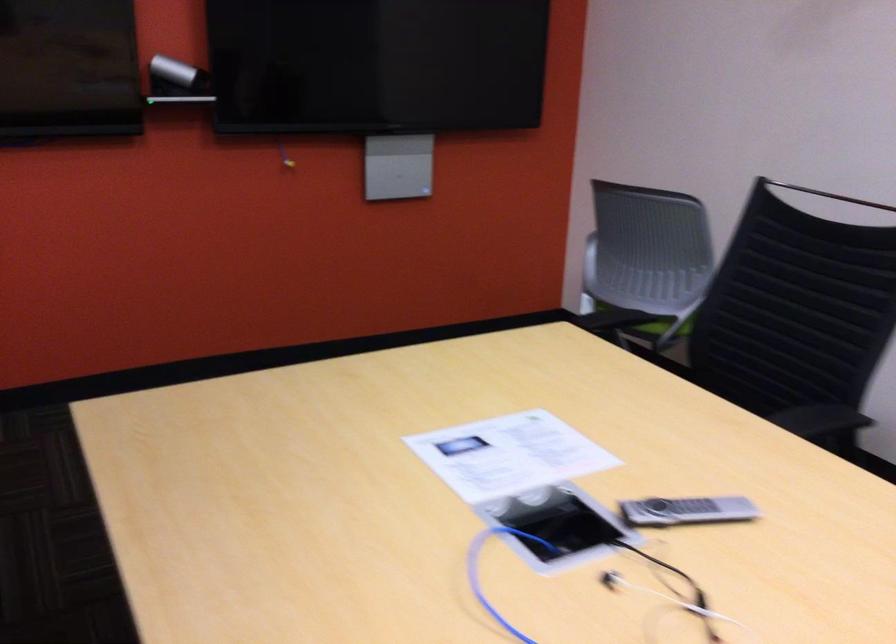
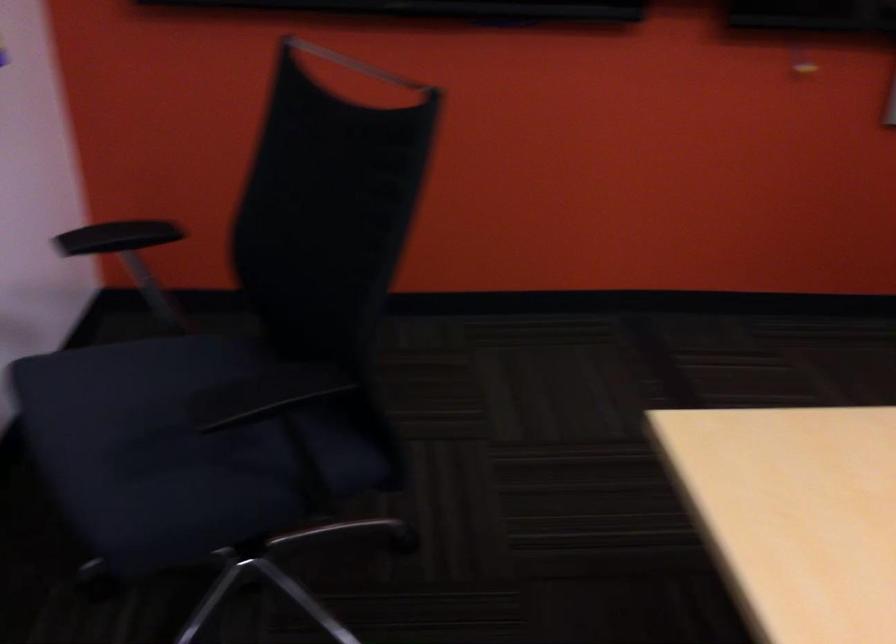
Question: Based on the continuous images, in which direction is the camera rotating? Reply with the corresponding letter.

Choices:
 (A) Left
 (B) Right
 (C) Up
 (D) Down

Answer: (A)